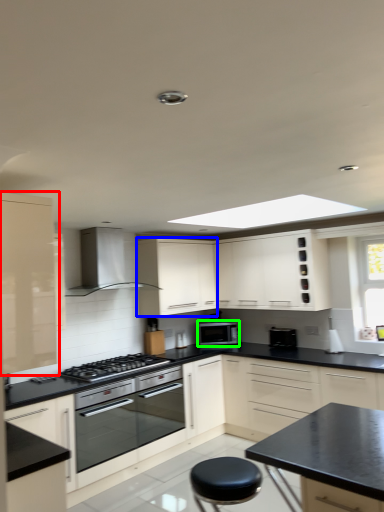
Question: Which object is the closest to the cabinetry (highlighted by a red box)? Choose among these: cabinetry (highlighted by a blue box) or microwave oven (highlighted by a green box).

Choices:
 (A) cabinetry
 (B) microwave oven

Answer: (A)